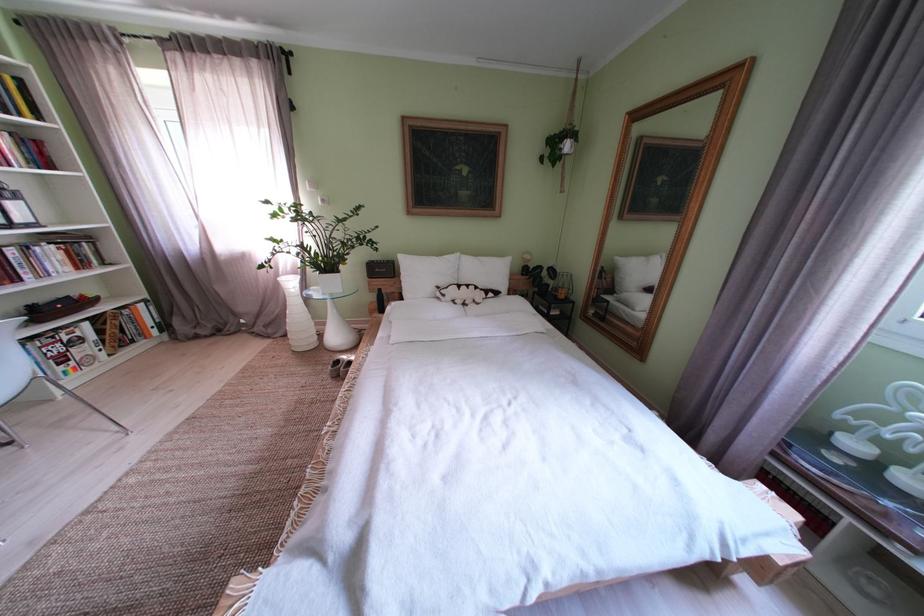
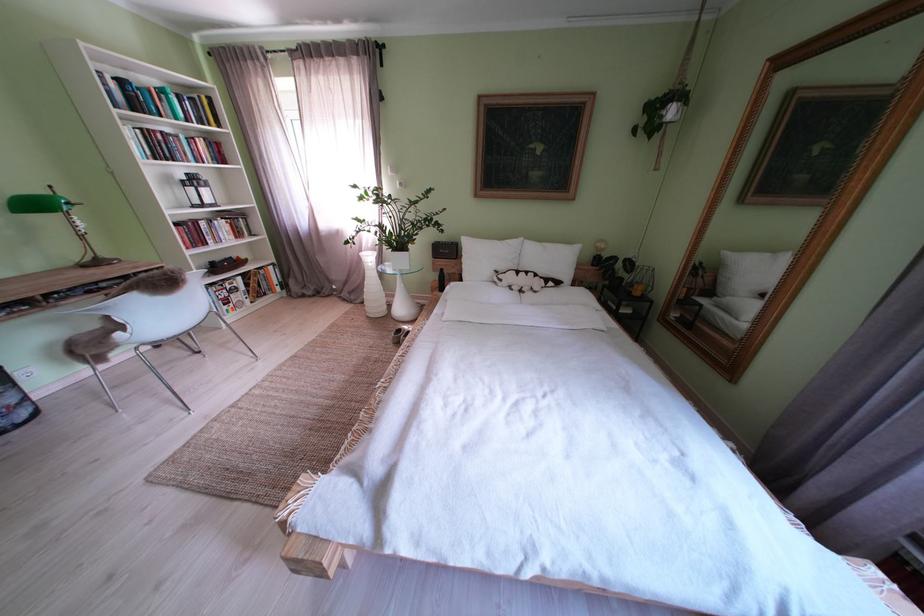
Find the pixel in the second image that matches (x=429, y=280) in the first image.

(490, 262)